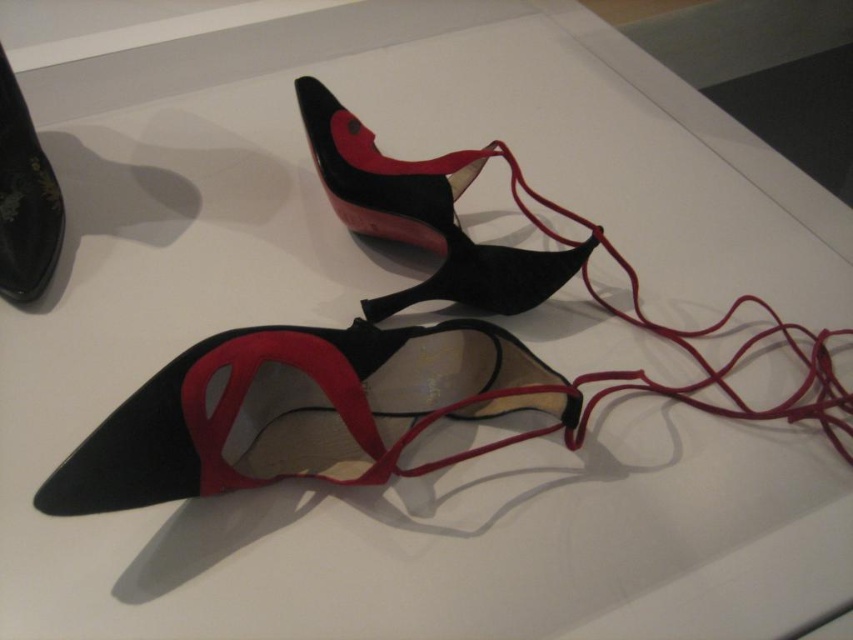
In the scene shown: Who is shorter, matte black high-heeled shoe at center or black suede shoe at left?

Standing shorter between the two is black suede shoe at left.

How much distance is there between matte black high-heeled shoe at center and black suede shoe at left?

The distance of matte black high-heeled shoe at center from black suede shoe at left is 23.87 inches.

Is point (541, 292) positioned behind point (33, 224)?

Yes, it is behind point (33, 224).

At what (x,y) coordinates should I click in order to perform the action: click on matte black high-heeled shoe at center. Please return your answer as a coordinate pair (x, y). This screenshot has width=853, height=640. Looking at the image, I should click on (422, 216).

Can you confirm if suede/black high-heeled shoe at center is positioned to the right of satin red shoe lace at center?

In fact, suede/black high-heeled shoe at center is to the left of satin red shoe lace at center.

Which is behind, point (119, 422) or point (814, 401)?

Positioned behind is point (814, 401).

Find the location of a particular element. suede/black high-heeled shoe at center is located at coordinates (293, 406).

Does satin red shoe lace at center have a smaller size compared to black suede shoe at left?

Incorrect, satin red shoe lace at center is not smaller in size than black suede shoe at left.

Is point (451, 234) behind point (13, 216)?

Yes, it is behind point (13, 216).

This screenshot has width=853, height=640. I want to click on satin red shoe lace at center, so coord(514,253).